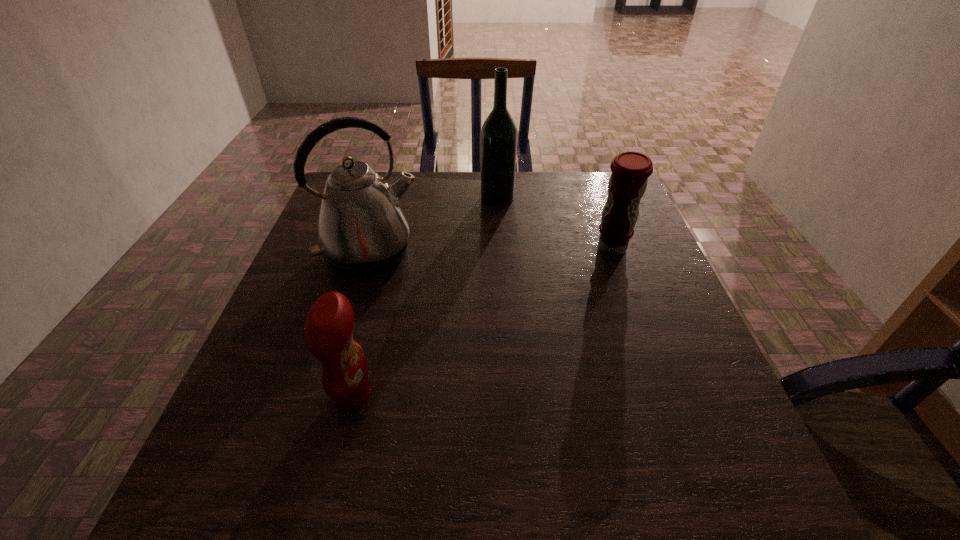
Identify the location of object that is the closest to the third object from left to right. The height and width of the screenshot is (540, 960). (362, 231).

This screenshot has height=540, width=960. I want to click on object that is the second nearest to the nearest object, so click(x=630, y=170).

This screenshot has width=960, height=540. I want to click on free space that satisfies the following two spatial constraints: 1. on the front side of the rightmost object; 2. on the label side of the left condiment, so click(x=664, y=395).

Where is `free space that satisfies the following two spatial constraints: 1. on the front side of the second object from right to left; 2. on the label side of the nearest object`? free space that satisfies the following two spatial constraints: 1. on the front side of the second object from right to left; 2. on the label side of the nearest object is located at coordinates (508, 395).